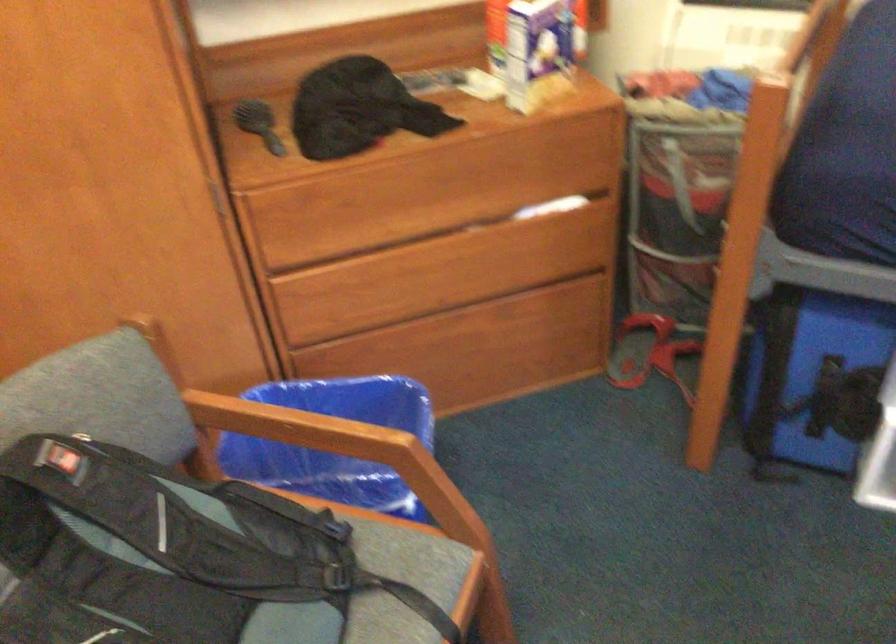
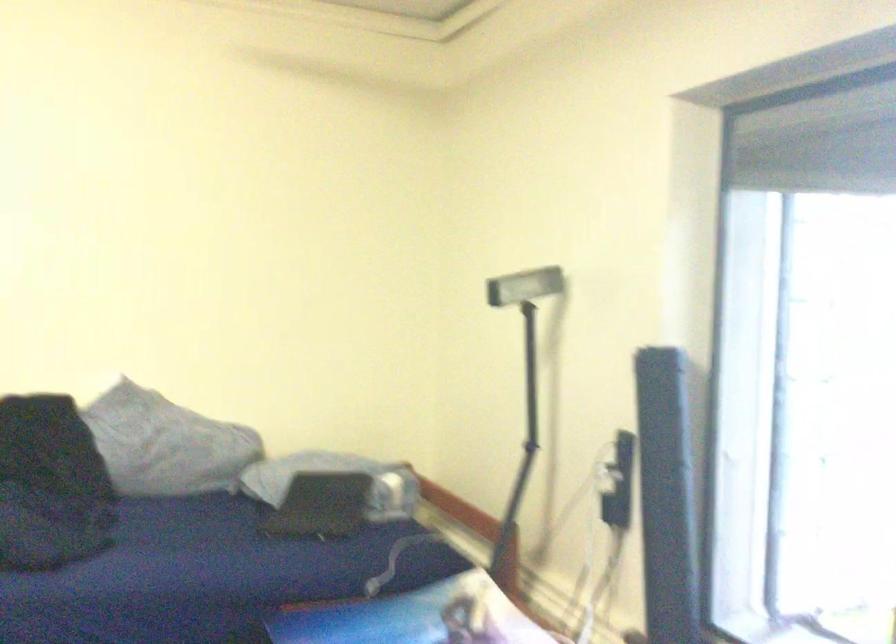
How did the camera likely rotate?

The rotation direction of the camera is right-up.